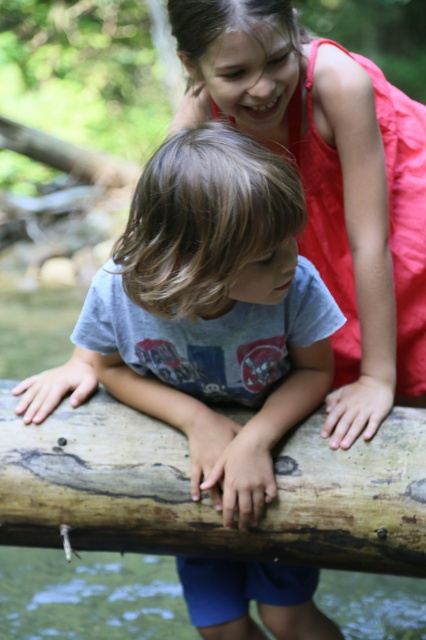
Question: Does gray cotton shirt at center have a larger size compared to brown rough log at center?

Choices:
 (A) yes
 (B) no

Answer: (A)

Question: Is matte red dress at upper right smaller than greenish-brown water at lower center?

Choices:
 (A) yes
 (B) no

Answer: (B)

Question: Estimate the real-world distances between objects in this image. Which object is farther from the greenish-brown water at lower center?

Choices:
 (A) matte red dress at upper right
 (B) brown rough log at center
 (C) gray cotton shirt at center

Answer: (A)

Question: Which object is closer to the camera taking this photo?

Choices:
 (A) matte red dress at upper right
 (B) brown rough log at center

Answer: (A)

Question: Is matte red dress at upper right above greenish-brown water at lower center?

Choices:
 (A) no
 (B) yes

Answer: (B)

Question: Which point appears farthest from the camera in this image?

Choices:
 (A) (374, 200)
 (B) (186, 365)

Answer: (A)